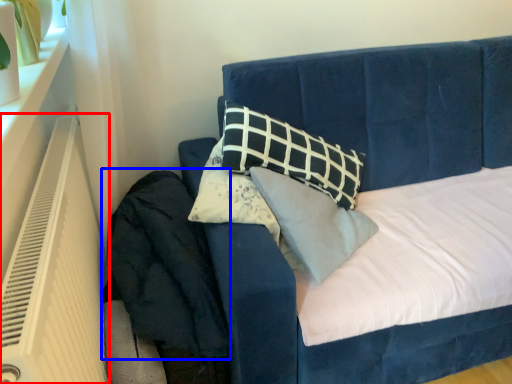
Question: Which point is further to the camera, heater (highlighted by a red box) or velvet (highlighted by a blue box)?

Choices:
 (A) heater
 (B) velvet

Answer: (B)